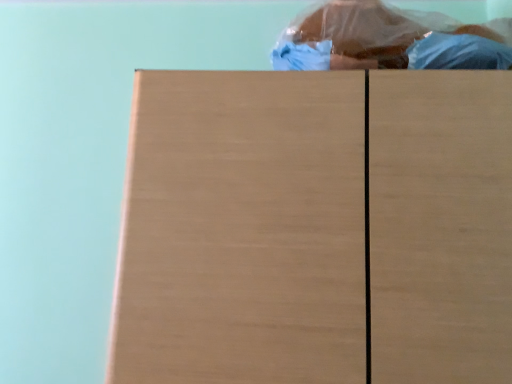
Question: Is blue plastic bag at upper center wider than light brown wood at center?

Choices:
 (A) no
 (B) yes

Answer: (A)

Question: Does blue plastic bag at upper center touch light brown wood at center?

Choices:
 (A) yes
 (B) no

Answer: (B)

Question: From a real-world perspective, does blue plastic bag at upper center sit lower than light brown wood at center?

Choices:
 (A) no
 (B) yes

Answer: (A)

Question: Would you say blue plastic bag at upper center is outside light brown wood at center?

Choices:
 (A) yes
 (B) no

Answer: (A)

Question: Is light brown wood at center at the back of blue plastic bag at upper center?

Choices:
 (A) no
 (B) yes

Answer: (A)

Question: Is the position of blue plastic bag at upper center more distant than that of light brown wood at center?

Choices:
 (A) yes
 (B) no

Answer: (A)

Question: Is light brown wood at center positioned behind blue plastic bag at upper center?

Choices:
 (A) no
 (B) yes

Answer: (A)

Question: Is light brown wood at center bigger than blue plastic bag at upper center?

Choices:
 (A) no
 (B) yes

Answer: (B)

Question: Are light brown wood at center and blue plastic bag at upper center making contact?

Choices:
 (A) no
 (B) yes

Answer: (A)

Question: Could blue plastic bag at upper center be considered to be inside light brown wood at center?

Choices:
 (A) yes
 (B) no

Answer: (B)

Question: Is light brown wood at center outside blue plastic bag at upper center?

Choices:
 (A) yes
 (B) no

Answer: (A)

Question: Can you confirm if light brown wood at center is wider than blue plastic bag at upper center?

Choices:
 (A) yes
 (B) no

Answer: (A)

Question: Is light brown wood at center taller or shorter than blue plastic bag at upper center?

Choices:
 (A) tall
 (B) short

Answer: (A)